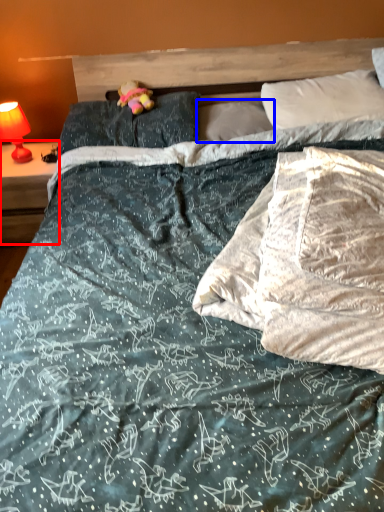
Question: Among these objects, which one is nearest to the camera, nightstand (highlighted by a red box) or pillow (highlighted by a blue box)?

Choices:
 (A) nightstand
 (B) pillow

Answer: (B)